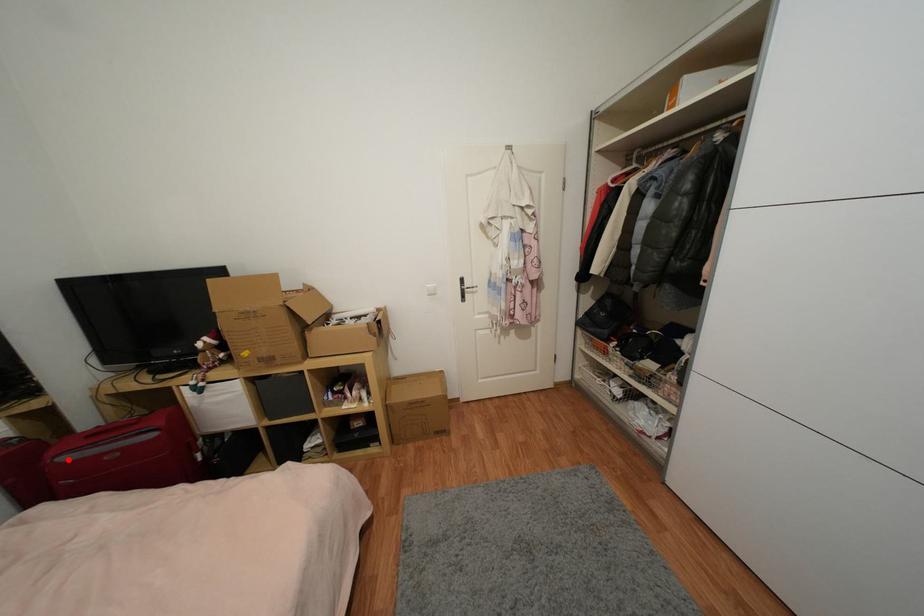
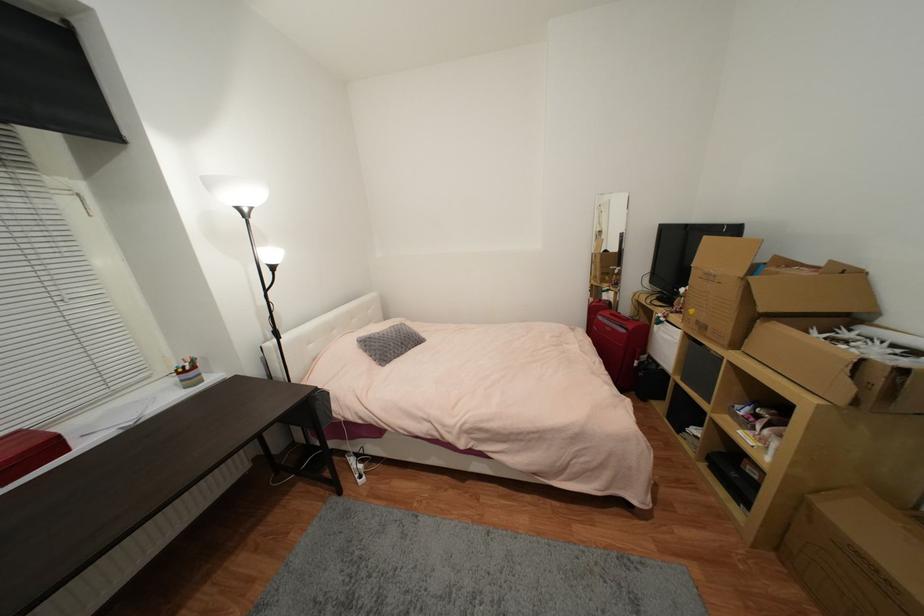
Locate, in the second image, the point that corresponds to the highlighted location in the first image.

(603, 318)